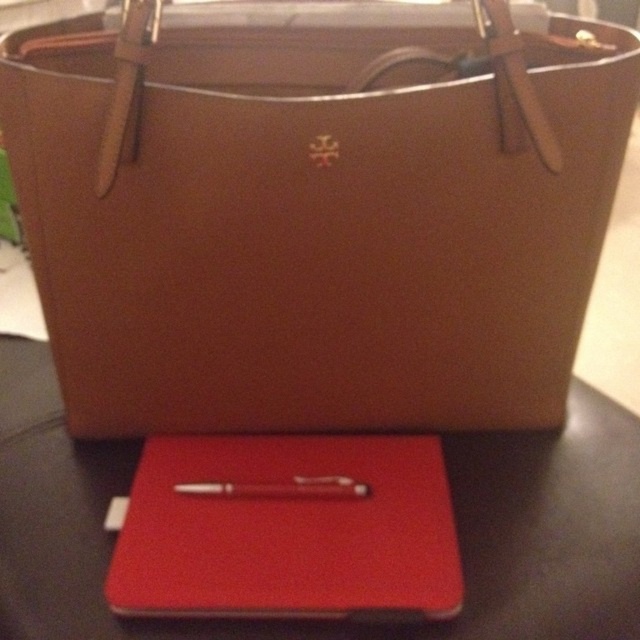
Question: Can you confirm if matte brown leather tote at center is wider than rubberized red notebook at center?

Choices:
 (A) no
 (B) yes

Answer: (B)

Question: Observing the image, what is the correct spatial positioning of matte brown leather tote at center in reference to matte red pen at center?

Choices:
 (A) right
 (B) left

Answer: (A)

Question: Which object is closer to the camera taking this photo?

Choices:
 (A) matte red pen at center
 (B) rubberized red notebook at center
 (C) matte brown leather tote at center
 (D) black leather table at center

Answer: (C)

Question: Which object appears farthest from the camera in this image?

Choices:
 (A) black leather table at center
 (B) matte brown leather tote at center

Answer: (A)

Question: Among these objects, which one is farthest from the camera?

Choices:
 (A) black leather table at center
 (B) rubberized red notebook at center
 (C) matte red pen at center
 (D) matte brown leather tote at center

Answer: (C)

Question: Can you confirm if rubberized red notebook at center is positioned to the right of matte red pen at center?

Choices:
 (A) no
 (B) yes

Answer: (B)